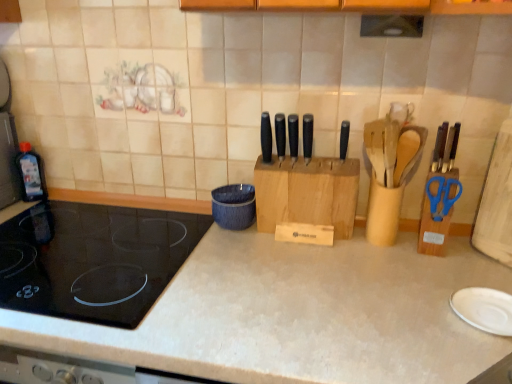
At what (x,y) coordinates should I click in order to perform the action: click on spots to the right of transparent plastic bottle at left. Please return your answer as a coordinate pair (x, y). The height and width of the screenshot is (384, 512). Looking at the image, I should click on (83, 205).